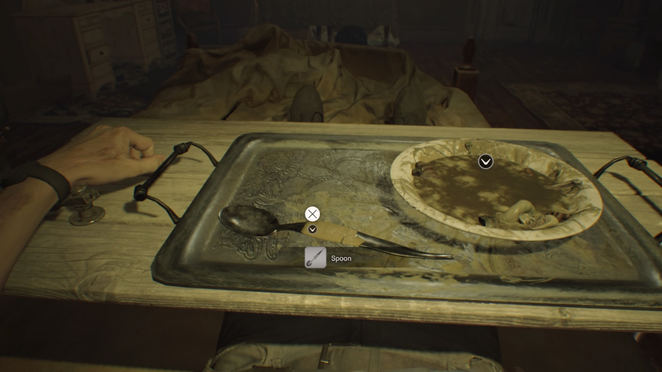
This screenshot has height=372, width=662. Find the location of `paper bowl`. paper bowl is located at coordinates (518, 237).